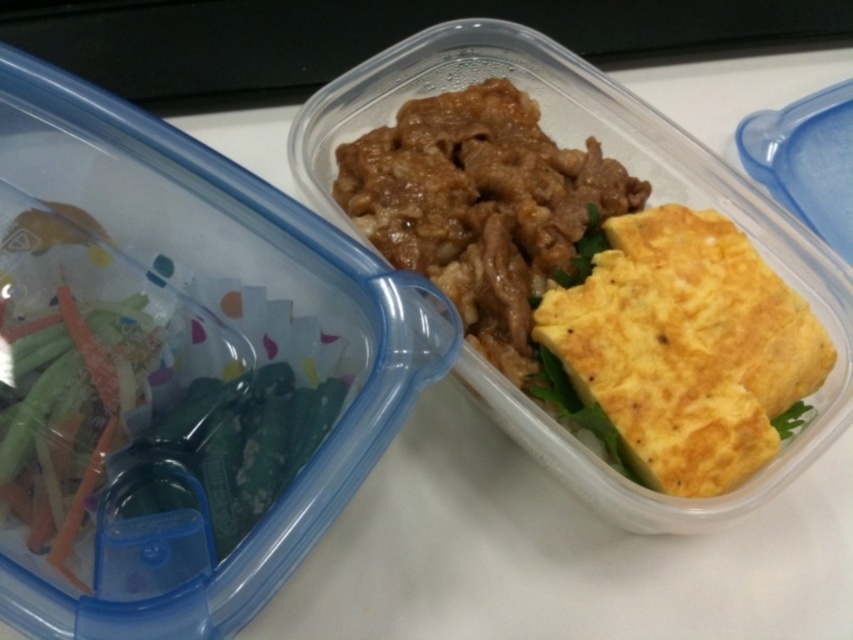
Can you confirm if yellow soft omelet at center right is smaller than brown glossy beef at center?

Yes, yellow soft omelet at center right is smaller than brown glossy beef at center.

This screenshot has width=853, height=640. Identify the location of yellow soft omelet at center right. (685, 348).